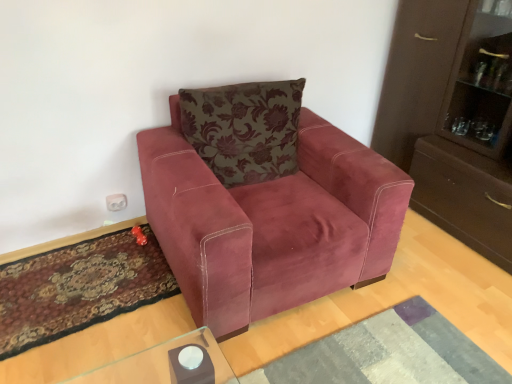
Question: Does carpeted rug at lower left, which ranks as the first mat in left-to-right order, have a lesser height compared to textured gray mat at lower center, which is counted as the first mat, starting from the right?

Choices:
 (A) yes
 (B) no

Answer: (A)

Question: Is carpeted rug at lower left, the 2th mat from the right, smaller than textured gray mat at lower center, placed as the second mat when sorted from left to right?

Choices:
 (A) yes
 (B) no

Answer: (A)

Question: Is carpeted rug at lower left, the 2th mat from the right, oriented away from textured gray mat at lower center, which is counted as the first mat, starting from the right?

Choices:
 (A) no
 (B) yes

Answer: (A)

Question: Can you confirm if carpeted rug at lower left, which ranks as the first mat in left-to-right order, is taller than textured gray mat at lower center, placed as the second mat when sorted from left to right?

Choices:
 (A) yes
 (B) no

Answer: (B)

Question: Is carpeted rug at lower left, which ranks as the first mat in left-to-right order, outside of textured gray mat at lower center, placed as the second mat when sorted from left to right?

Choices:
 (A) yes
 (B) no

Answer: (A)

Question: Is carpeted rug at lower left, the 2th mat from the right, positioned before textured gray mat at lower center, which is counted as the first mat, starting from the right?

Choices:
 (A) yes
 (B) no

Answer: (B)

Question: Is textured gray mat at lower center, which is counted as the first mat, starting from the right, placed right next to velvet floral pillow at center?

Choices:
 (A) no
 (B) yes

Answer: (A)

Question: Is textured gray mat at lower center, placed as the second mat when sorted from left to right, to the right of velvet floral pillow at center from the viewer's perspective?

Choices:
 (A) yes
 (B) no

Answer: (A)

Question: Are textured gray mat at lower center, which is counted as the first mat, starting from the right, and velvet floral pillow at center far apart?

Choices:
 (A) no
 (B) yes

Answer: (A)

Question: From the image's perspective, does textured gray mat at lower center, which is counted as the first mat, starting from the right, appear lower than velvet floral pillow at center?

Choices:
 (A) yes
 (B) no

Answer: (A)

Question: Is velvet floral pillow at center located within textured gray mat at lower center, placed as the second mat when sorted from left to right?

Choices:
 (A) yes
 (B) no

Answer: (B)

Question: From the image's perspective, is textured gray mat at lower center, placed as the second mat when sorted from left to right, above velvet floral pillow at center?

Choices:
 (A) no
 (B) yes

Answer: (A)

Question: From a real-world perspective, is velvet floral pillow at center below textured gray mat at lower center, which is counted as the first mat, starting from the right?

Choices:
 (A) yes
 (B) no

Answer: (B)